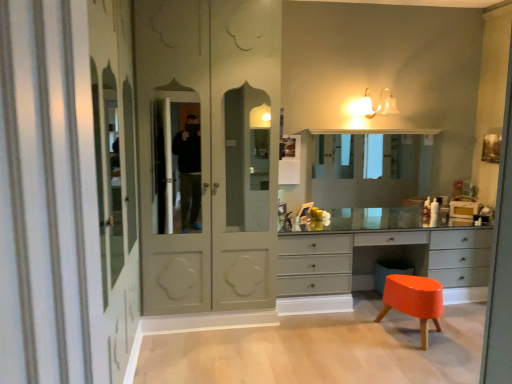
Question: From a real-world perspective, is matte glass sconce at upper center physically below matte white wardrobe at center?

Choices:
 (A) no
 (B) yes

Answer: (A)

Question: From a real-world perspective, is matte glass sconce at upper center on matte white wardrobe at center?

Choices:
 (A) yes
 (B) no

Answer: (A)

Question: Considering the relative positions of matte glass sconce at upper center and matte white wardrobe at center in the image provided, is matte glass sconce at upper center to the right of matte white wardrobe at center from the viewer's perspective?

Choices:
 (A) no
 (B) yes

Answer: (B)

Question: From the image's perspective, is matte glass sconce at upper center above matte white wardrobe at center?

Choices:
 (A) yes
 (B) no

Answer: (A)

Question: Is matte glass sconce at upper center facing away from matte white wardrobe at center?

Choices:
 (A) yes
 (B) no

Answer: (B)

Question: From a real-world perspective, is clear glass medicine cabinet at center physically located above or below matte gray chest of drawers at center?

Choices:
 (A) above
 (B) below

Answer: (A)

Question: From the image's perspective, is clear glass medicine cabinet at center positioned above or below matte gray chest of drawers at center?

Choices:
 (A) above
 (B) below

Answer: (A)

Question: Is point (360, 172) positioned closer to the camera than point (449, 283)?

Choices:
 (A) closer
 (B) farther

Answer: (B)

Question: Is clear glass medicine cabinet at center situated inside matte gray chest of drawers at center or outside?

Choices:
 (A) inside
 (B) outside

Answer: (B)

Question: Is matte white wardrobe at center situated inside matte glass sconce at upper center or outside?

Choices:
 (A) outside
 (B) inside

Answer: (A)

Question: From a real-world perspective, is matte white wardrobe at center physically located above or below matte glass sconce at upper center?

Choices:
 (A) above
 (B) below

Answer: (B)

Question: In the image, is matte white wardrobe at center positioned in front of or behind matte glass sconce at upper center?

Choices:
 (A) front
 (B) behind

Answer: (A)

Question: Is matte white wardrobe at center bigger or smaller than matte glass sconce at upper center?

Choices:
 (A) small
 (B) big

Answer: (B)

Question: Is point click(x=353, y=104) closer or farther from the camera than point click(x=252, y=289)?

Choices:
 (A) farther
 (B) closer

Answer: (A)

Question: From the image's perspective, is matte glass sconce at upper center above or below matte white wardrobe at center?

Choices:
 (A) above
 (B) below

Answer: (A)